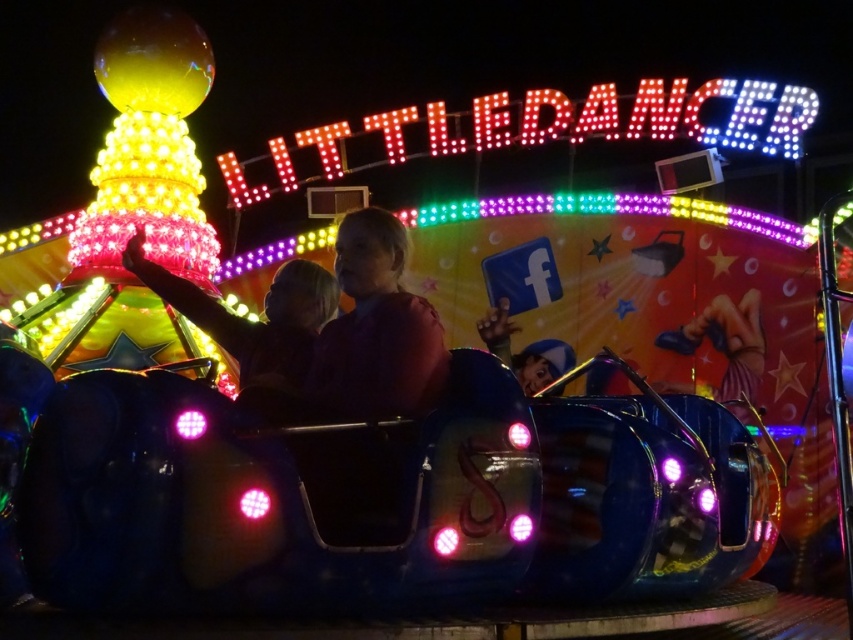
You are standing in the fairground and see the LITTLE DANCER ride with its illuminated sign. There is a point marked at coordinates [376,328]. Which object from the scene does this point belong to?

The point at coordinates [376,328] is located on the pink matte shirt at center.

You are a photographer trying to capture the fairground ride scene. You notice the pink matte shirt at center and the shiny metallic car at center. Which object should you focus on if you want to highlight something smaller in the image?

The pink matte shirt at center has a smaller size compared to the shiny metallic car at center, so you should focus on the pink matte shirt at center to highlight the smaller object.